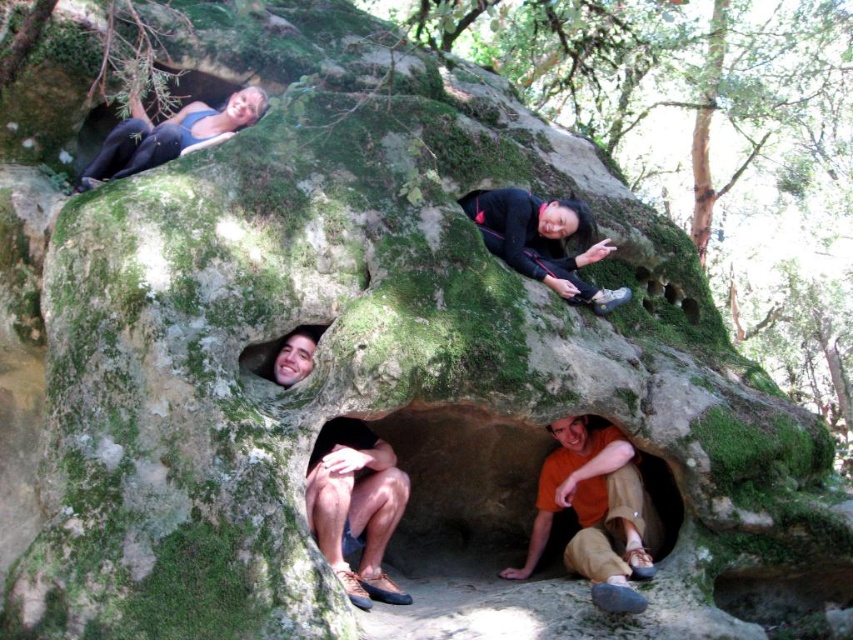
Does black fabric jacket at upper right appear on the right side of smooth skin face at center?

Indeed, black fabric jacket at upper right is positioned on the right side of smooth skin face at center.

Who is shorter, black fabric jacket at upper right or smooth skin face at center?

smooth skin face at center

Locate an element on the screen. Image resolution: width=853 pixels, height=640 pixels. black fabric jacket at upper right is located at coordinates (543, 241).

You are a GUI agent. You are given a task and a screenshot of the screen. Output one action in this format:
    pyautogui.click(x=<x>, y=<y>)
    Task: Click on the black fabric jacket at upper right
    
    Given the screenshot: What is the action you would take?
    point(543,241)

Can you confirm if brown suede shoes at lower center is positioned below black fabric jacket at upper right?

Indeed, brown suede shoes at lower center is positioned under black fabric jacket at upper right.

Is brown suede shoes at lower center wider than black fabric jacket at upper right?

No, brown suede shoes at lower center is not wider than black fabric jacket at upper right.

Find the location of a particular element. brown suede shoes at lower center is located at coordinates (355, 506).

The image size is (853, 640). Identify the location of brown suede shoes at lower center. (355, 506).

Is point (321, 545) farther from viewer compared to point (287, 381)?

That is False.

From the picture: Does brown suede shoes at lower center have a larger size compared to smooth skin face at center?

Indeed, brown suede shoes at lower center has a larger size compared to smooth skin face at center.

Does point (352, 515) come farther from viewer compared to point (306, 365)?

Yes, it is behind point (306, 365).

This screenshot has height=640, width=853. I want to click on brown suede shoes at lower center, so click(x=355, y=506).